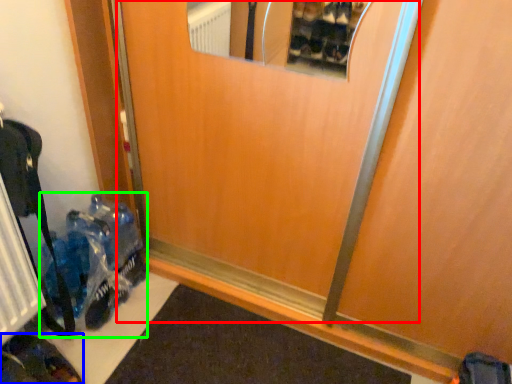
Question: Estimate the real-world distances between objects in this image. Which object is farther from elevator door (highlighted by a red box), footwear (highlighted by a blue box) or toy (highlighted by a green box)?

Choices:
 (A) footwear
 (B) toy

Answer: (A)